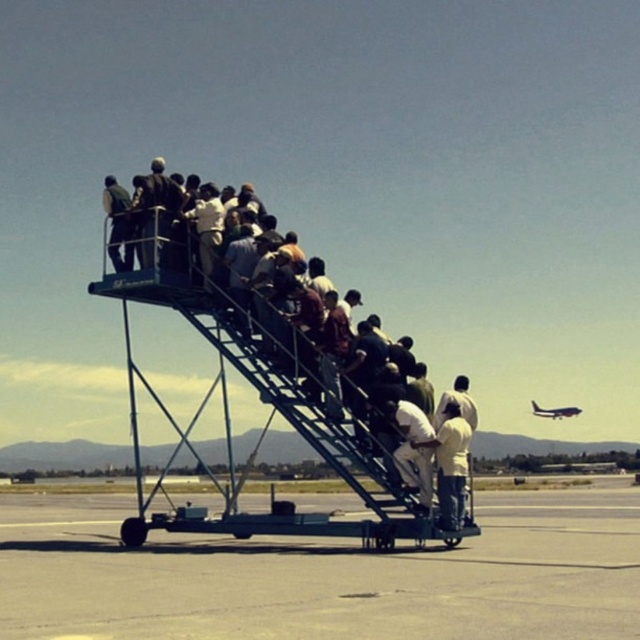
You are a luggage cart operator who needs to transport a heavy suitcase from the smooth concrete tarmac at lower left to the metallic silver airplane at upper right. The maximum distance your cart can travel is 40 meters. Can you reach the airplane without exceeding the cart limit?

The distance between the smooth concrete tarmac at lower left and the metallic silver airplane at upper right is 41.05 meters, which exceeds the cart limit of 40 meters. Therefore, you cannot reach the airplane without exceeding the distance limit.

You are standing on the smooth concrete tarmac at lower left and want to reach the dark blue metal staircase at center. Based on the scene description, which direction should you move to get there?

The smooth concrete tarmac at lower left is to the right of the dark blue metal staircase at center, so you should move to your left to reach it.

Based on the photo, you are standing on the smooth concrete tarmac at lower left and want to reach the mobile staircase where people are boarding. Based on the scene description, in which direction should you move relative to your current position?

The smooth concrete tarmac at lower left is located at point (324, 577), so you should move towards the center or upper area of the image to reach the mobile staircase where people are boarding.